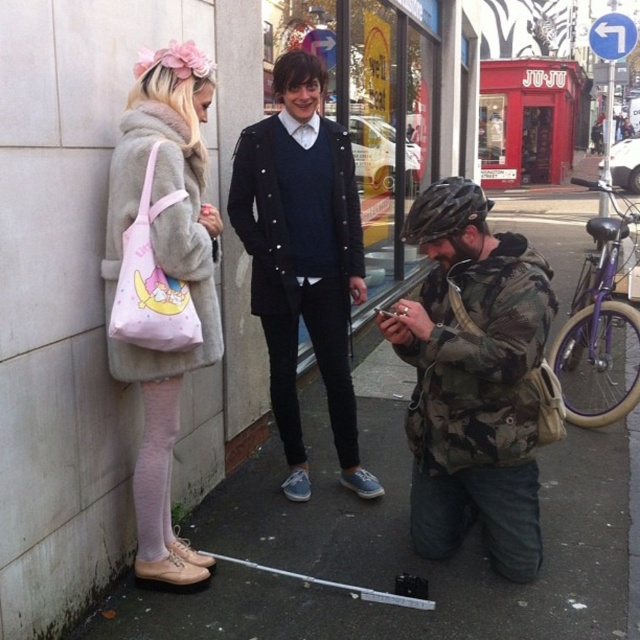
Between camo jacket at lower right and fuzzy beige coat at left, which one has more height?

With more height is fuzzy beige coat at left.

Is camo jacket at lower right above fuzzy beige coat at left?

No, camo jacket at lower right is not above fuzzy beige coat at left.

What do you see at coordinates (472, 380) in the screenshot? Image resolution: width=640 pixels, height=640 pixels. I see `camo jacket at lower right` at bounding box center [472, 380].

The height and width of the screenshot is (640, 640). In order to click on camo jacket at lower right in this screenshot , I will do [x=472, y=380].

Does camo jacket at lower right have a lesser width compared to matte black coat at upper center?

Yes, camo jacket at lower right is thinner than matte black coat at upper center.

Who is more distant from viewer, [486,330] or [355,189]?

Positioned behind is point [355,189].

Where is `camo jacket at lower right`? camo jacket at lower right is located at coordinates (472, 380).

Measure the distance between matte black coat at upper center and red matte storefront at center.

A distance of 58.39 feet exists between matte black coat at upper center and red matte storefront at center.

Is matte black coat at upper center to the right of red matte storefront at center from the viewer's perspective?

No, matte black coat at upper center is not to the right of red matte storefront at center.

Between point (282, 404) and point (563, 125), which one is positioned behind?

The point (563, 125) is behind.

Where is `matte black coat at upper center`? matte black coat at upper center is located at coordinates (301, 259).